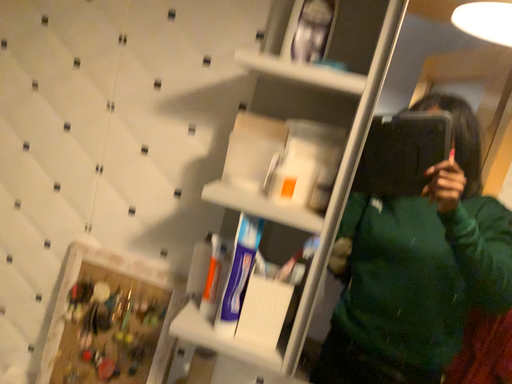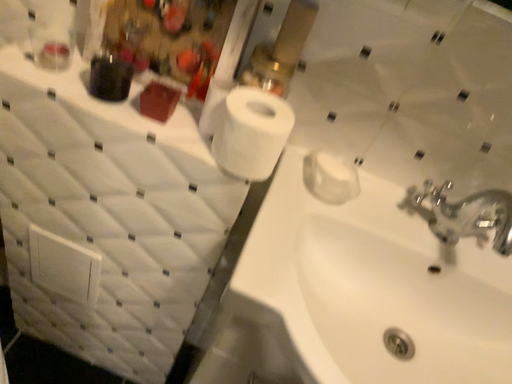
Question: Which way did the camera rotate in the video?

Choices:
 (A) rotated upward
 (B) rotated downward

Answer: (B)